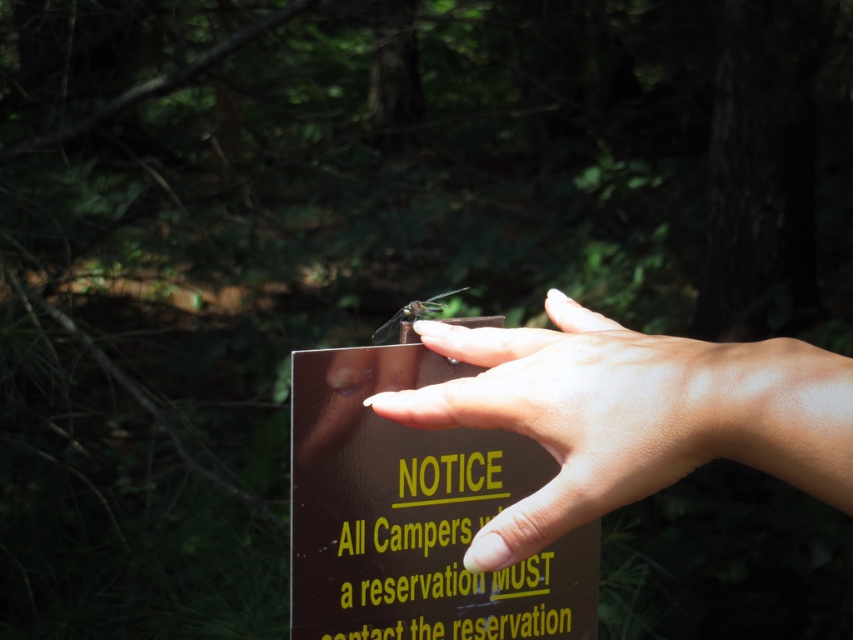
You are a photographer trying to capture a dragonfly in a forest scene. You notice a smooth brown hand at center and a translucent brown dragonfly at center. Which object should you focus on first to ensure the dragonfly stays in focus?

The smooth brown hand at center is closer to the viewer than the translucent brown dragonfly at center. To ensure the dragonfly stays in focus, you should focus on the dragonfly first since it is farther away and requires adjusting the focus beyond the hand.

You are a park ranger checking the visibility of the sign for visitors. Considering the size difference between the brown glossy sign at center and the translucent brown dragonfly at center, which one is more likely to be easily noticed by someone passing by?

The brown glossy sign at center is more likely to be easily noticed because it is wider than the translucent brown dragonfly at center.

You are a photographer trying to capture a closeup of both the smooth brown hand at center and the translucent brown dragonfly at center in the scene. Given that your camera has a maximum focus range of 5 inches, will you be able to include both subjects in the shot?

The smooth brown hand at center and the translucent brown dragonfly at center are 4.84 inches apart from each other. Since the distance between them is within the camera maximum focus range of 5 inches, you can include both subjects in the shot.